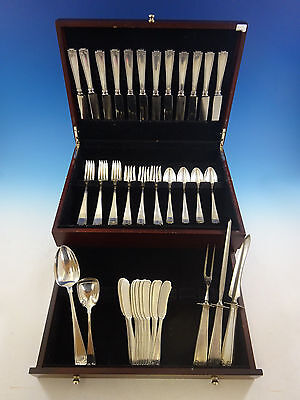
At what (x,y) coordinates should I click in order to perform the action: click on forks. Please return your answer as a coordinate pair (x, y). The image size is (300, 400). Looking at the image, I should click on coord(91,168), coord(99,169), coord(120,176), coord(132,175), coord(142,176), coord(154,176).